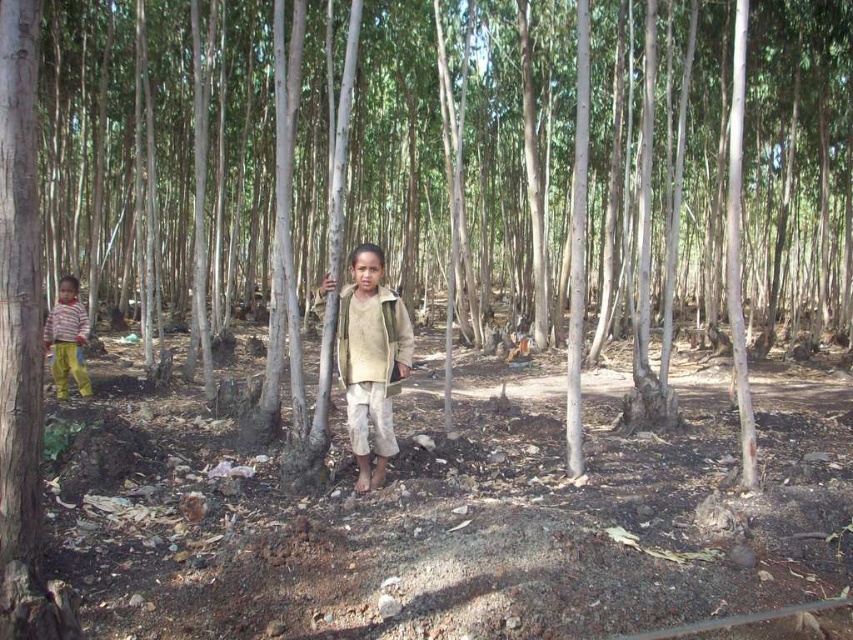
Question: Is light beige fabric jacket at center smaller than striped cotton pants at left?

Choices:
 (A) yes
 (B) no

Answer: (A)

Question: Can you confirm if light beige fabric jacket at center is positioned to the right of striped cotton pants at left?

Choices:
 (A) yes
 (B) no

Answer: (A)

Question: Considering the relative positions of light beige fabric jacket at center and striped cotton pants at left in the image provided, where is light beige fabric jacket at center located with respect to striped cotton pants at left?

Choices:
 (A) left
 (B) right

Answer: (B)

Question: Which point is farther to the camera?

Choices:
 (A) (389, 336)
 (B) (78, 364)

Answer: (B)

Question: Which of the following is the farthest from the observer?

Choices:
 (A) pyautogui.click(x=397, y=324)
 (B) pyautogui.click(x=44, y=336)

Answer: (B)

Question: Among these points, which one is farthest from the camera?

Choices:
 (A) (357, 488)
 (B) (68, 326)

Answer: (B)